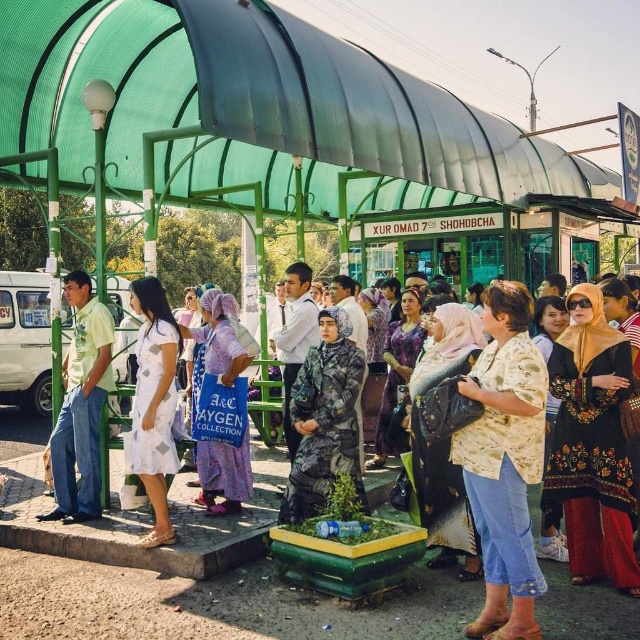
Question: Does light beige printed blouse at center appear on the left side of purple fabric headscarf at center?

Choices:
 (A) no
 (B) yes

Answer: (A)

Question: Which of the following is the farthest from the observer?

Choices:
 (A) green fabric canopy at upper center
 (B) purple fabric headscarf at center

Answer: (B)

Question: Which point is closer to the camera?

Choices:
 (A) light green shirt at center
 (B) purple fabric headscarf at center
 (C) white printed dress at center
 (D) light beige printed blouse at center

Answer: (D)

Question: Which point is farther from the camera taking this photo?

Choices:
 (A) (225, 496)
 (B) (17, 74)
 (C) (593, 314)

Answer: (B)

Question: Can you confirm if black embroidered dress at center is wider than white printed dress at center?

Choices:
 (A) yes
 (B) no

Answer: (A)

Question: Is black embroidered dress at center wider than light green shirt at center?

Choices:
 (A) yes
 (B) no

Answer: (B)